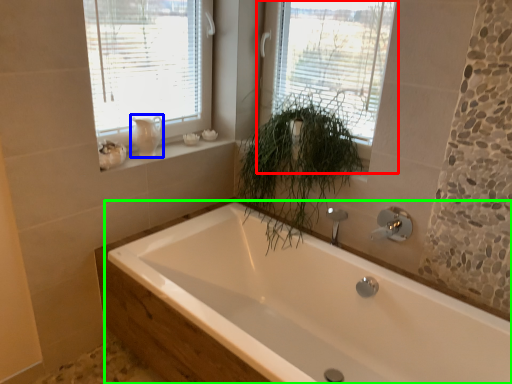
Question: Which is nearer to the window (highlighted by a red box)? gray (highlighted by a blue box) or bathtub (highlighted by a green box).

Choices:
 (A) gray
 (B) bathtub

Answer: (A)